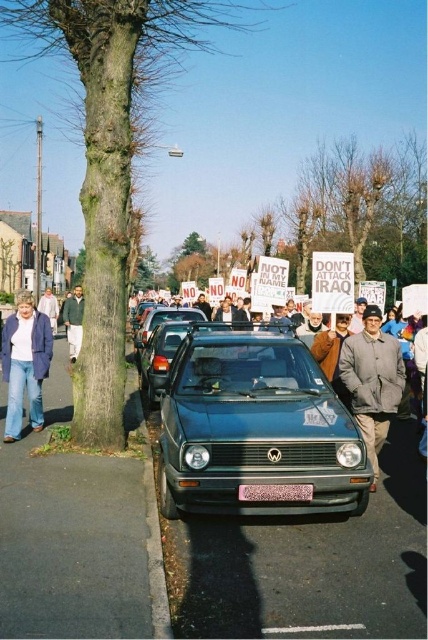
Question: Is green bark tree at left closer to the viewer compared to bare branches tree at upper center?

Choices:
 (A) yes
 (B) no

Answer: (A)

Question: Which point is closer to the camera taking this photo?

Choices:
 (A) (339, 234)
 (B) (359, 358)
 (C) (155, 317)
 (D) (71, 316)

Answer: (B)

Question: Where is green bark tree at left located in relation to dark green jacket at center in the image?

Choices:
 (A) left
 (B) right

Answer: (A)

Question: Can you confirm if bare branches tree at upper center is positioned to the right of pink plastic license plate at center?

Choices:
 (A) no
 (B) yes

Answer: (B)

Question: Which point is closer to the camera taking this photo?

Choices:
 (A) (264, 493)
 (B) (394, 244)

Answer: (A)

Question: Which point is closer to the camera?

Choices:
 (A) (154, 323)
 (B) (26, 344)
 (C) (356, 346)
 (D) (92, 193)

Answer: (C)